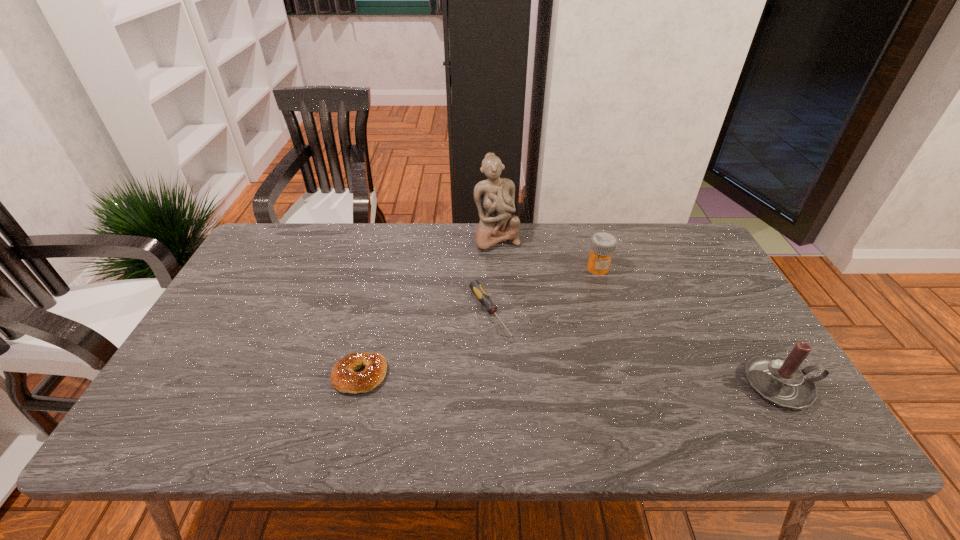
Locate an element on the screen. free point at the far left corner is located at coordinates (293, 244).

You are a GUI agent. You are given a task and a screenshot of the screen. Output one action in this format:
    pyautogui.click(x=<x>, y=<y>)
    Task: Click on the vacant point at the far right corner
    This screenshot has width=960, height=540.
    Given the screenshot: What is the action you would take?
    pyautogui.click(x=676, y=247)

Find the location of a particular element. The height and width of the screenshot is (540, 960). free location at the near right corner of the desktop is located at coordinates (730, 397).

Locate an element on the screen. free space that is in between the second shortest object and the fourth shortest object is located at coordinates (570, 381).

Locate an element on the screen. This screenshot has width=960, height=540. empty location between the fourth shortest object and the shortest object is located at coordinates (636, 349).

This screenshot has width=960, height=540. Identify the location of free space between the second farthest object and the figurine. (547, 253).

Find the location of `vacant space in between the fourth tallest object and the third shortest object`. vacant space in between the fourth tallest object and the third shortest object is located at coordinates (479, 322).

Image resolution: width=960 pixels, height=540 pixels. I want to click on vacant space in between the second shortest object and the fourth shortest object, so click(x=570, y=381).

Find the location of a particular element. The height and width of the screenshot is (540, 960). blank region between the figurine and the screwdriver is located at coordinates (493, 275).

Where is `vacant area between the bagel and the figurine`? vacant area between the bagel and the figurine is located at coordinates (428, 307).